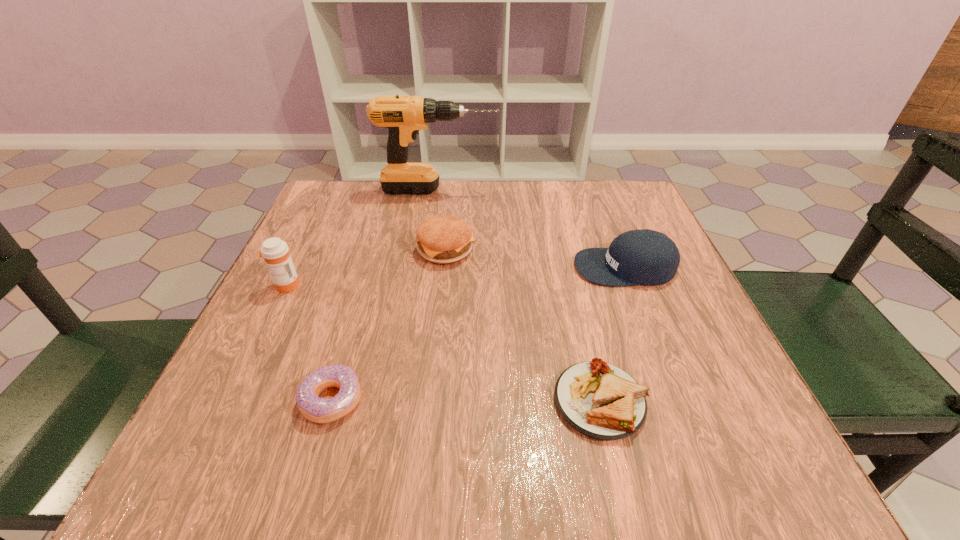
Identify the location of blank space located on the front-facing side of the baseball cap. (437, 267).

You are a GUI agent. You are given a task and a screenshot of the screen. Output one action in this format:
    pyautogui.click(x=<x>, y=<y>)
    Task: Click on the vacant position located 0.270m on the front-facing side of the baseball cap
    
    Given the screenshot: What is the action you would take?
    pyautogui.click(x=446, y=267)

Where is `free location located on the front-facing side of the baseball cap`? This screenshot has height=540, width=960. free location located on the front-facing side of the baseball cap is located at coordinates (451, 267).

Where is `vacant area located on the left of the third shortest object`? vacant area located on the left of the third shortest object is located at coordinates (327, 249).

Image resolution: width=960 pixels, height=540 pixels. I want to click on free space located 0.060m on the right of the doughnut, so click(400, 400).

Where is `vacant space located on the right of the sandwich`? This screenshot has width=960, height=540. vacant space located on the right of the sandwich is located at coordinates (697, 401).

Identify the location of object that is positioned at the far edge. The width and height of the screenshot is (960, 540). (404, 116).

Find the location of `doughnut located at the near edge`. doughnut located at the near edge is located at coordinates (319, 410).

Find the location of a particular element. sandwich positioned at the near edge is located at coordinates (601, 401).

Identify the location of drill located in the left edge section of the desktop. (404, 116).